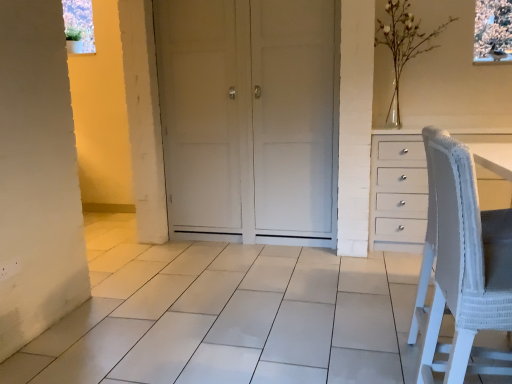
Measure the distance between white woven fabric chair at right and camera.

white woven fabric chair at right is 1.06 meters away from camera.

This screenshot has height=384, width=512. Identify the location of white matte door at center. (250, 119).

Describe the element at coordinates (403, 47) in the screenshot. I see `white glass vase at upper right` at that location.

Identify the location of white woven fabric chair at right. Image resolution: width=512 pixels, height=384 pixels. (461, 265).

From a real-world perspective, who is located lower, white glass vase at upper right or white woven fabric chair at right?

From a 3D spatial view, white woven fabric chair at right is below.

In terms of size, does white glass vase at upper right appear bigger or smaller than white woven fabric chair at right?

In the image, white glass vase at upper right appears to be larger than white woven fabric chair at right.

Considering their positions, is white glass vase at upper right located in front of or behind white woven fabric chair at right?

white glass vase at upper right is behind white woven fabric chair at right.

Is white glass vase at upper right touching white woven fabric chair at right?

No, white glass vase at upper right is not in contact with white woven fabric chair at right.

From a real-world perspective, relative to white glass vase at upper right, is white woven fabric chair at right vertically above or below?

From a real-world perspective, white woven fabric chair at right is physically below white glass vase at upper right.

Considering the sizes of objects white woven fabric chair at right and white glass vase at upper right in the image provided, who is thinner, white woven fabric chair at right or white glass vase at upper right?

With smaller width is white woven fabric chair at right.

Considering the relative sizes of white woven fabric chair at right and white glass vase at upper right in the image provided, is white woven fabric chair at right bigger than white glass vase at upper right?

Actually, white woven fabric chair at right might be smaller than white glass vase at upper right.

Is white woven fabric chair at right facing towards white glass vase at upper right?

No, white woven fabric chair at right is not aimed at white glass vase at upper right.

Considering the positions of objects white glass vase at upper right and white matte door at center in the image provided, who is more to the left, white glass vase at upper right or white matte door at center?

white matte door at center.

Would you say white glass vase at upper right is a long distance from white matte door at center?

That's right, there is a large distance between white glass vase at upper right and white matte door at center.

Is white glass vase at upper right wider than white matte door at center?

In fact, white glass vase at upper right might be narrower than white matte door at center.

From the image's perspective, is white matte door at center located beneath white woven fabric chair at right?

No, from the image's perspective, white matte door at center is not beneath white woven fabric chair at right.

Identify the location of rocking chair in front of the white matte door at center. (461, 265).

Is white matte door at center not close to white woven fabric chair at right?

Yes, white matte door at center and white woven fabric chair at right are located far from each other.

From the image's perspective, is white matte door at center above white glass vase at upper right?

No.

Between white matte door at center and white glass vase at upper right, which one has smaller width?

white glass vase at upper right is thinner.

Is white matte door at center taller than white glass vase at upper right?

Yes.

Looking at this image, considering the positions of objects white matte door at center and white glass vase at upper right in the image provided, who is more to the right, white matte door at center or white glass vase at upper right?

white glass vase at upper right is more to the right.

From a real-world perspective, is white woven fabric chair at right above or below white matte door at center?

white woven fabric chair at right is situated lower than white matte door at center in the real world.

Is white woven fabric chair at right positioned with its back to white matte door at center?

No, white woven fabric chair at right is not facing away from white matte door at center.

Between white woven fabric chair at right and white matte door at center, which one has less height?

white woven fabric chair at right is shorter.

From the picture: From the image's perspective, is white woven fabric chair at right above white matte door at center?

No.

The height and width of the screenshot is (384, 512). I want to click on rocking chair directly beneath the white glass vase at upper right (from a real-world perspective), so click(x=461, y=265).

You are a GUI agent. You are given a task and a screenshot of the screen. Output one action in this format:
    pyautogui.click(x=<x>, y=<y>)
    Task: Click on the rocking chair lying in front of the white glass vase at upper right
    This screenshot has height=384, width=512.
    Given the screenshot: What is the action you would take?
    pyautogui.click(x=461, y=265)

Which object lies nearer to the anchor point white glass vase at upper right, white woven fabric chair at right or white matte door at center?

white matte door at center lies closer to white glass vase at upper right than the other object.

Based on their spatial positions, is white glass vase at upper right or white matte door at center further from white woven fabric chair at right?

Among the two, white glass vase at upper right is located further to white woven fabric chair at right.

Which object lies nearer to the anchor point white glass vase at upper right, white matte door at center or white woven fabric chair at right?

white matte door at center is positioned closer to the anchor white glass vase at upper right.

Looking at the image, which one is located closer to white matte door at center, white woven fabric chair at right or white glass vase at upper right?

The object closer to white matte door at center is white glass vase at upper right.

Considering their positions, is white glass vase at upper right positioned closer to white matte door at center than white woven fabric chair at right?

white glass vase at upper right lies closer to white matte door at center than the other object.

Estimate the real-world distances between objects in this image. Which object is further from white woven fabric chair at right, white matte door at center or white glass vase at upper right?

white glass vase at upper right.

Find the location of a particular element. The image size is (512, 384). door between white woven fabric chair at right and white glass vase at upper right along the z-axis is located at coordinates (250, 119).